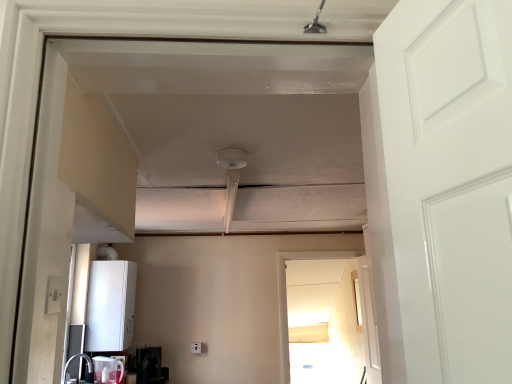
Question: From the image's perspective, is matte white sink at lower left positioned above or below white plastic electric outlet at lower left?

Choices:
 (A) below
 (B) above

Answer: (A)

Question: Does point (91, 369) appear closer or farther from the camera than point (51, 292)?

Choices:
 (A) farther
 (B) closer

Answer: (A)

Question: Which of these objects is positioned farthest from the white glossy jug at lower left, which appears as the second appliance when viewed from the top?

Choices:
 (A) matte white sink at lower left
 (B) white matte boiler at lower left, which ranks as the 1th appliance in top-to-bottom order
 (C) white glossy door at right
 (D) white plastic electric outlet at lower left
 (E) black glossy microwave at lower left, the 1th appliance positioned from the bottom

Answer: (D)

Question: Based on their relative distances, which object is nearer to the white plastic electric outlet at lower left?

Choices:
 (A) white matte boiler at lower left, the 3th appliance when ordered from bottom to top
 (B) white glossy door at right
 (C) matte white sink at lower left
 (D) white glossy jug at lower left, which appears as the second appliance when viewed from the top
 (E) black glossy microwave at lower left, the third appliance in the top-to-bottom sequence

Answer: (C)